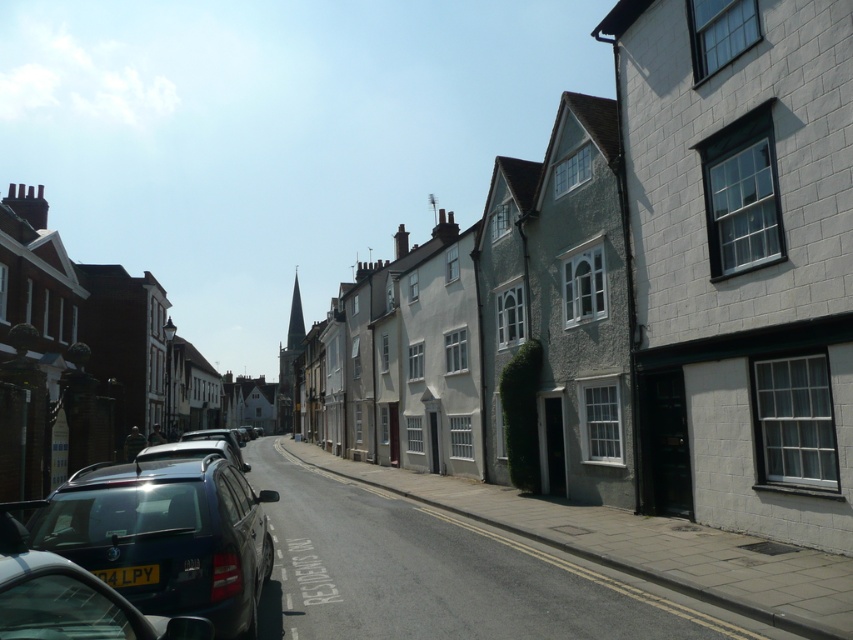
Is point (817, 214) farther from camera compared to point (202, 595)?

Yes, point (817, 214) is behind point (202, 595).

Can you confirm if white brick building at center is positioned below shiny dark blue suv at lower left?

No.

Is point (685, 298) closer to viewer compared to point (54, 547)?

No, (685, 298) is behind (54, 547).

You are a GUI agent. You are given a task and a screenshot of the screen. Output one action in this format:
    pyautogui.click(x=<x>, y=<y>)
    Task: Click on the white brick building at center
    The width and height of the screenshot is (853, 640).
    Given the screenshot: What is the action you would take?
    pyautogui.click(x=740, y=259)